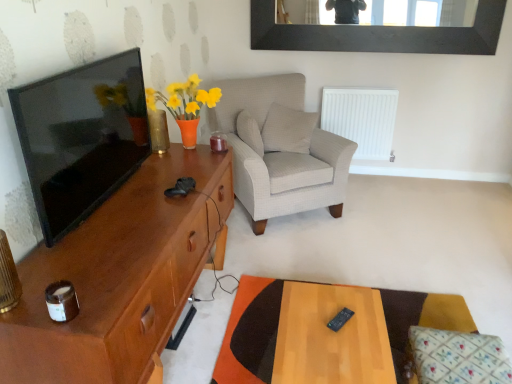
Locate an element on the screen. free space above floral fabric cushion at lower right, acting as the third pillow starting from the left (from a real-world perspective) is located at coordinates coord(465,354).